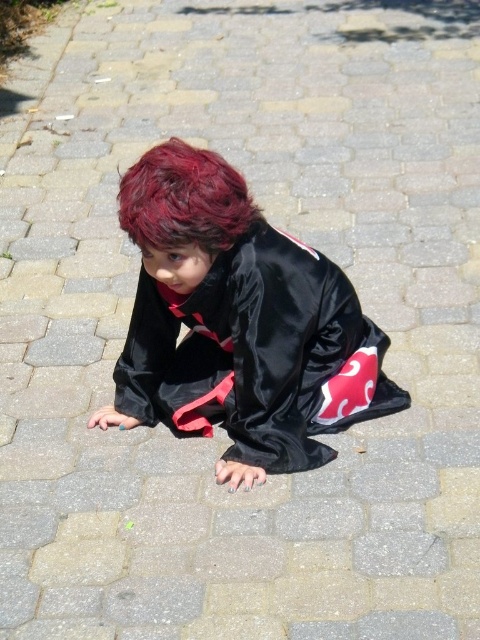
You are a photographer trying to capture a closeup of the shiny red hair at center and the satin black kimono at center. Since you want both objects in focus, which one should you focus on first to ensure the other is also in focus?

You should focus on the satin black kimono at center first because the shiny red hair at center is behind it, so if the kimono is in focus, the hair will naturally be in focus as well due to its position behind.

The child is wearing a satin black kimono at center and has shiny red hair at center. Which of these is wider?

The satin black kimono at center is wider than the shiny red hair at center.

You are a photographer trying to position a subject in the center of the image. The scene has a satin black kimono at center. Where should you place the subject to ensure it aligns with the kimono?

The satin black kimono at center is located at point (238, 323), so you should position the subject at the same coordinates to align with it.